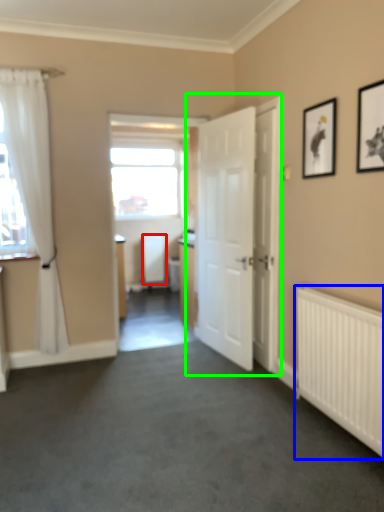
Question: Based on their relative distances, which object is farther from radiator (highlighted by a red box)? Choose from radiator (highlighted by a blue box) and door (highlighted by a green box).

Choices:
 (A) radiator
 (B) door

Answer: (A)